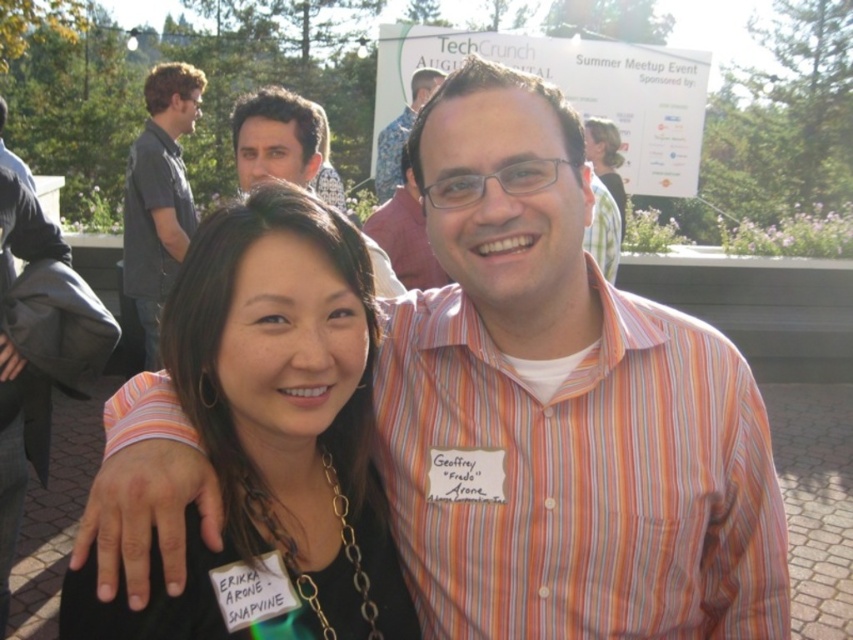
Is dark gray shirt at upper left thinner than matte striped shirt at center?

Incorrect, dark gray shirt at upper left's width is not less than matte striped shirt at center's.

Is dark gray shirt at upper left shorter than matte striped shirt at center?

In fact, dark gray shirt at upper left may be taller than matte striped shirt at center.

Is point (164, 74) behind point (430, 284)?

Yes, point (164, 74) is behind point (430, 284).

At what (x,y) coordinates should I click in order to perform the action: click on dark gray shirt at upper left. Please return your answer as a coordinate pair (x, y). Looking at the image, I should click on (160, 195).

Is striped cotton shirt at center positioned behind dark gray shirt at upper left?

That is False.

Which is in front, point (666, 339) or point (138, 209)?

Positioned in front is point (666, 339).

The image size is (853, 640). What are the coordinates of `striped cotton shirt at center` in the screenshot? It's located at (579, 480).

Can you confirm if dark gray shirt at upper left is positioned to the left of matte black shirt at center?

Yes, dark gray shirt at upper left is to the left of matte black shirt at center.

Which is in front, point (180, 163) or point (286, 166)?

Point (286, 166)

Which is behind, point (192, 74) or point (293, 104)?

The point (192, 74) is more distant.

You are a GUI agent. You are given a task and a screenshot of the screen. Output one action in this format:
    pyautogui.click(x=<x>, y=<y>)
    Task: Click on the dark gray shirt at upper left
    The height and width of the screenshot is (640, 853).
    Given the screenshot: What is the action you would take?
    coord(160,195)